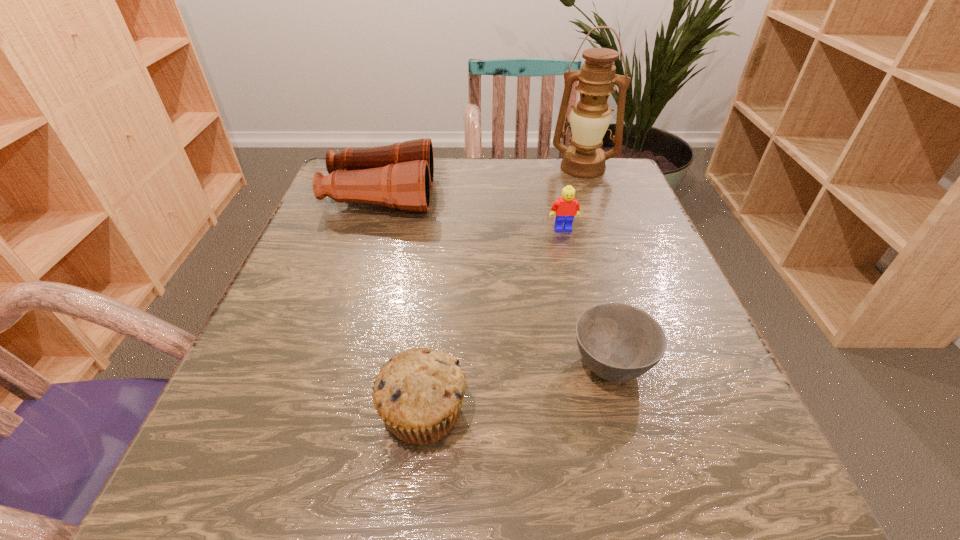
Locate an element on the screen. The width and height of the screenshot is (960, 540). vacant point located between the bowl and the muffin is located at coordinates (516, 388).

This screenshot has height=540, width=960. Find the location of `empty space between the bowl and the third farthest object`. empty space between the bowl and the third farthest object is located at coordinates (587, 297).

Find the location of `free space between the muffin and the binoculars`. free space between the muffin and the binoculars is located at coordinates (401, 304).

In order to click on object that is the second closest one to the third farthest object in this screenshot , I will do `click(400, 175)`.

I want to click on the fourth closest object to the tallest object, so coord(418,394).

At what (x,y) coordinates should I click in order to perform the action: click on free space that satisfies the following two spatial constraints: 1. through the lenses of the shortest object; 2. on the left side of the binoculars. Please return your answer as a coordinate pair (x, y). This screenshot has width=960, height=540. Looking at the image, I should click on (327, 364).

You are a GUI agent. You are given a task and a screenshot of the screen. Output one action in this format:
    pyautogui.click(x=<x>, y=<y>)
    Task: Click on the vacant region that satisfies the following two spatial constraints: 1. through the lenses of the bowl; 2. on the right side of the binoculars
    
    Given the screenshot: What is the action you would take?
    pyautogui.click(x=327, y=364)

You are a GUI agent. You are given a task and a screenshot of the screen. Output one action in this format:
    pyautogui.click(x=<x>, y=<y>)
    Task: Click on the free space in the image that satisfies the following two spatial constraints: 1. on the back side of the shortest object; 2. through the lenses of the binoculars
    The width and height of the screenshot is (960, 540).
    Given the screenshot: What is the action you would take?
    pyautogui.click(x=565, y=196)